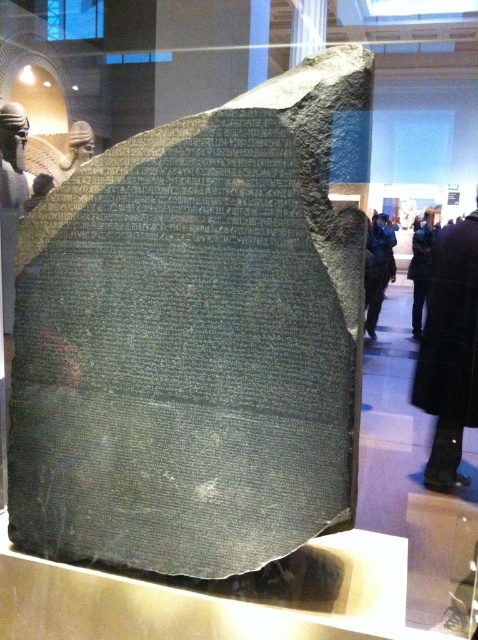
Question: Which of the following is the farthest from the observer?

Choices:
 (A) black leather coat at lower right
 (B) dark blue coat at center
 (C) black wool coat at lower right

Answer: (A)

Question: Does dark blue coat at center appear under black leather coat at lower right?

Choices:
 (A) no
 (B) yes

Answer: (B)

Question: Which point is farther to the camera?

Choices:
 (A) (158, 509)
 (B) (378, 248)

Answer: (B)

Question: Can you confirm if black wool coat at lower right is smaller than dark blue coat at center?

Choices:
 (A) yes
 (B) no

Answer: (B)

Question: Which of the following is the closest to the observer?

Choices:
 (A) dark blue coat at center
 (B) black leather coat at lower right

Answer: (A)

Question: Can you confirm if green stone stele at center is positioned to the right of dark blue coat at center?

Choices:
 (A) no
 (B) yes

Answer: (A)